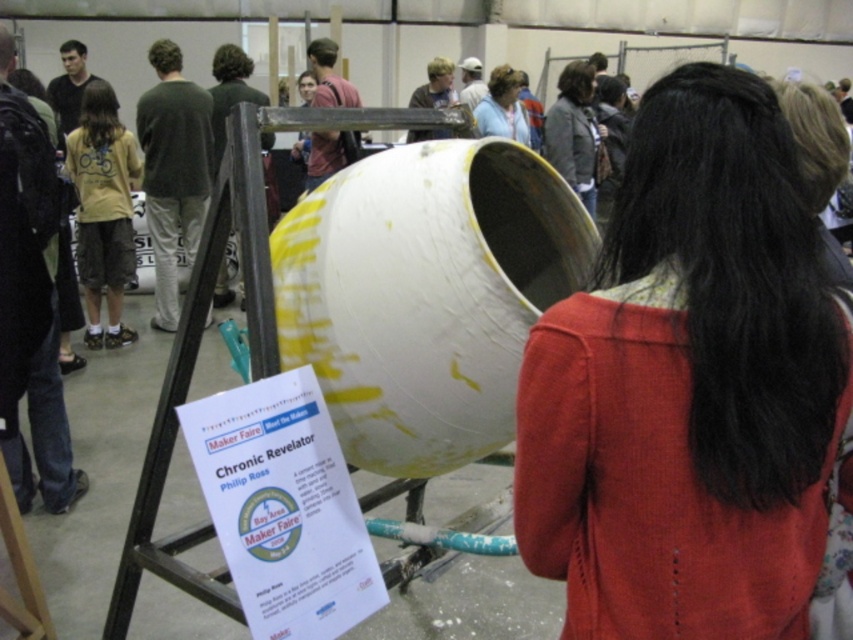
Can you confirm if knitted red sweater at center is smaller than light blue fabric shirt at upper center?

No.

Which is behind, point (788, 321) or point (500, 115)?

Positioned behind is point (500, 115).

This screenshot has height=640, width=853. Describe the element at coordinates (689, 385) in the screenshot. I see `knitted red sweater at center` at that location.

In order to click on knitted red sweater at center in this screenshot , I will do `click(689, 385)`.

Who is shorter, knitted red sweater at center or dark brown leather jacket at center?

With less height is knitted red sweater at center.

Between point (692, 480) and point (584, 195), which one is positioned in front?

Point (692, 480) is in front.

What do you see at coordinates (689, 385) in the screenshot? I see `knitted red sweater at center` at bounding box center [689, 385].

Locate an element on the screen. knitted red sweater at center is located at coordinates (689, 385).

Is dark brown leather jacket at center above light blue fabric shirt at upper center?

No, dark brown leather jacket at center is not above light blue fabric shirt at upper center.

At what (x,y) coordinates should I click in order to perform the action: click on dark brown leather jacket at center. Please return your answer as a coordinate pair (x, y). Looking at the image, I should click on (576, 132).